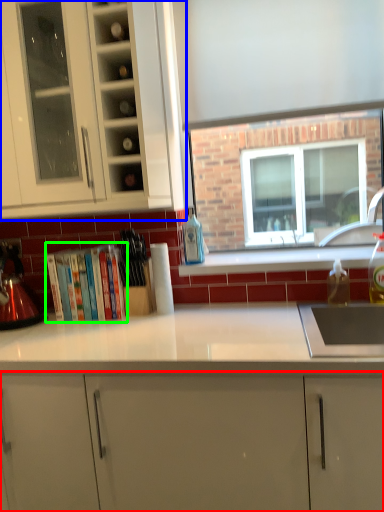
Question: Based on their relative distances, which object is nearer to cabinetry (highlighted by a red box)? Choose from cabinetry (highlighted by a blue box) and book (highlighted by a green box).

Choices:
 (A) cabinetry
 (B) book

Answer: (B)